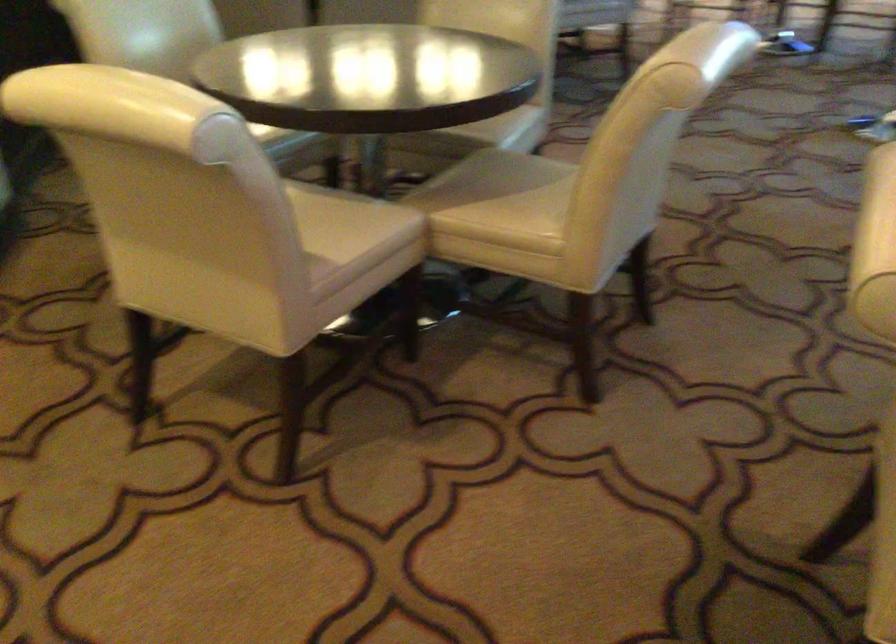
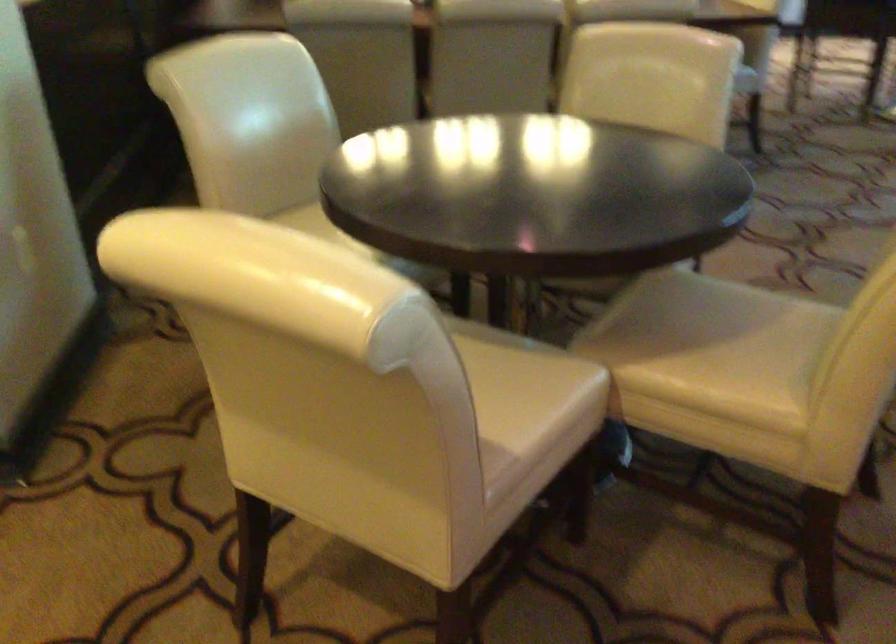
Locate, in the second image, the point that corresponds to the point at 530,187 in the first image.

(743, 330)